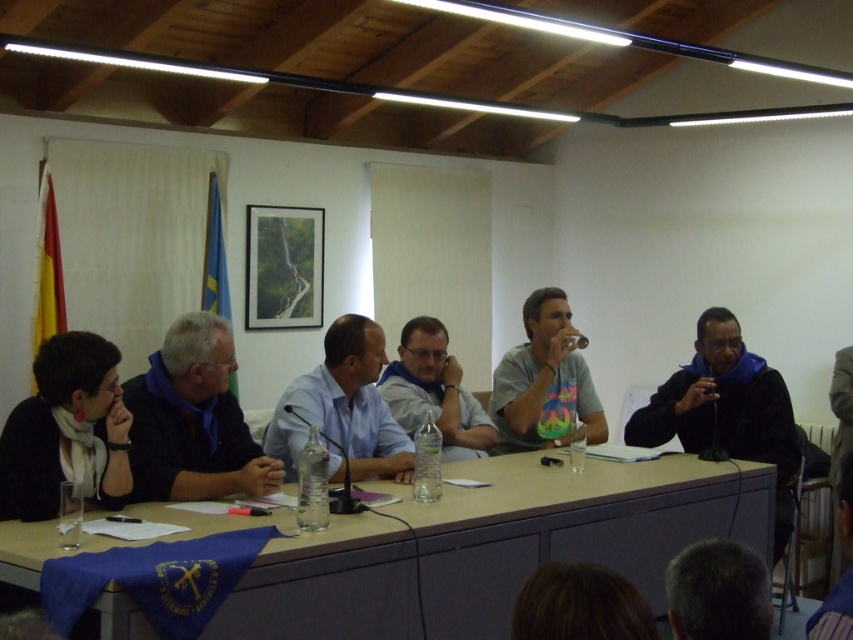
You are a photographer taking a photo of the meeting participants. You notice the black matte jacket at right and the light blue shirt at center. Which clothing item is closer to the bottom of the photo?

The black matte jacket at right is positioned under the light blue shirt at center, so it is closer to the bottom of the photo.

You are organizing a small event and need to place two items on a table. The blue fabric at left and the black matte jacket at right are already placed. Which item takes up more space on the table?

The black matte jacket at right takes up more space on the table since it is larger than the blue fabric at left.